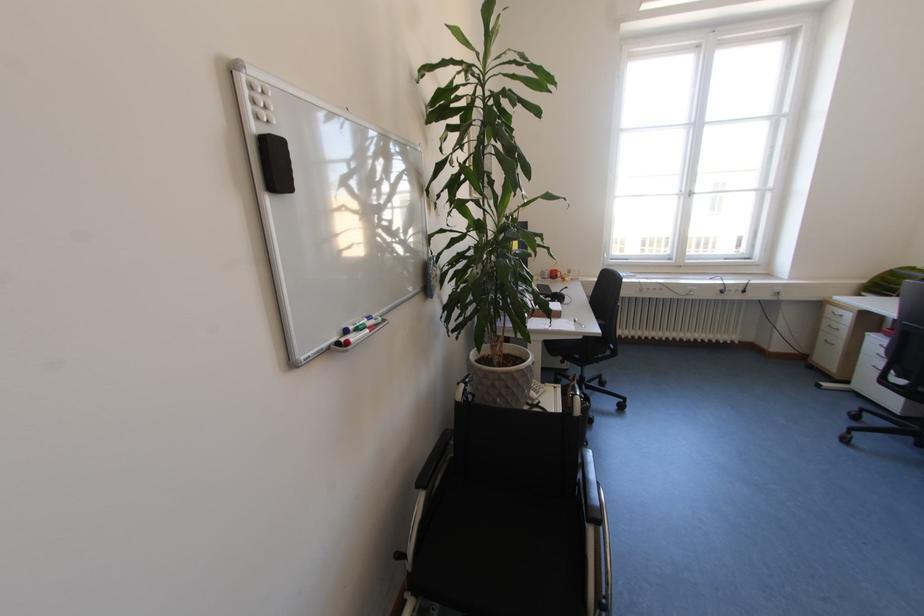
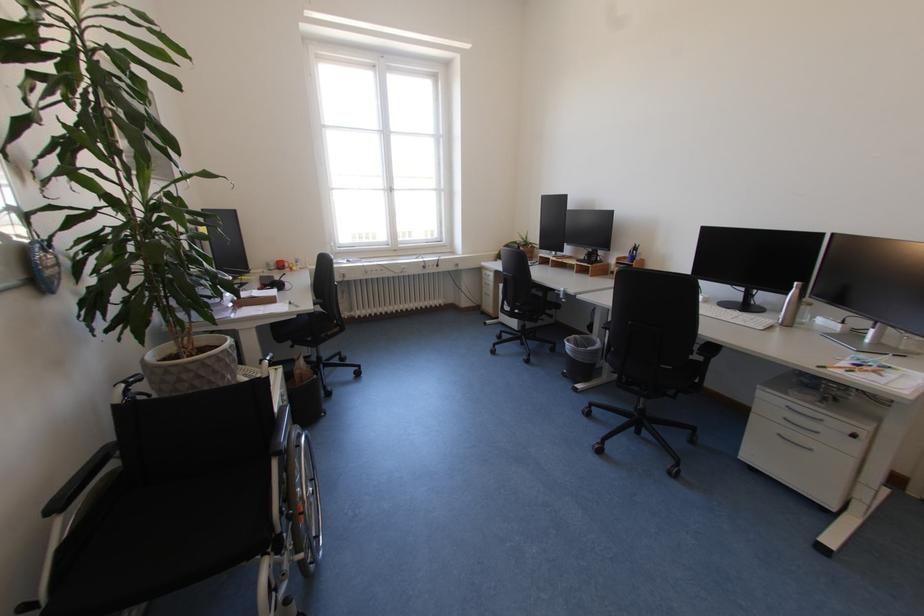
Question: The first image is from the beginning of the video and the second image is from the end. How did the camera likely rotate when shooting the video?

Choices:
 (A) Left
 (B) Right
 (C) Up
 (D) Down

Answer: (B)